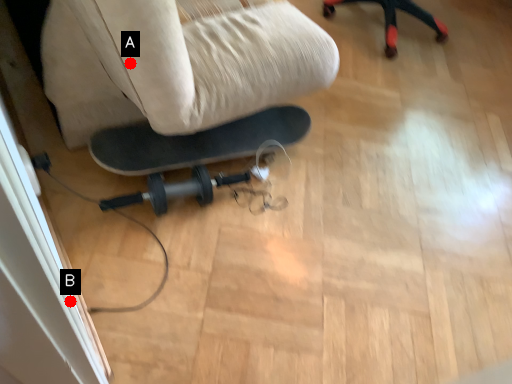
Question: Two points are circled on the image, labeled by A and B beside each circle. Among these points, which one is nearest to the camera?

Choices:
 (A) A is closer
 (B) B is closer

Answer: (B)